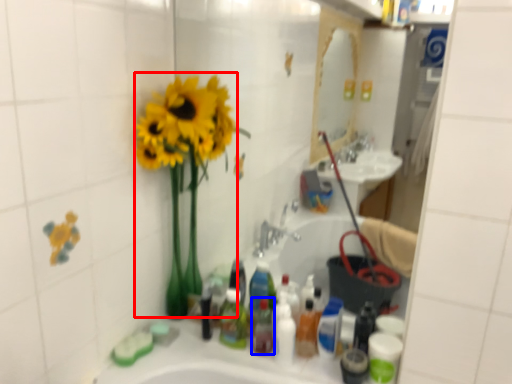
Question: Which object appears closest to the camera in this image, floral arrangement (highlighted by a red box) or mouthwash (highlighted by a blue box)?

Choices:
 (A) floral arrangement
 (B) mouthwash

Answer: (A)